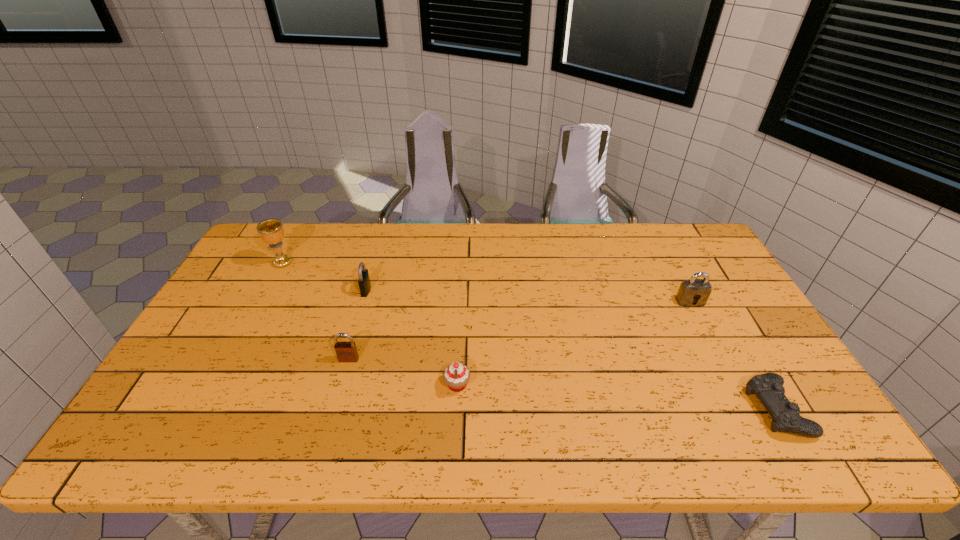
Identify the location of free space located 0.110m on the back of the shortest object. This screenshot has height=540, width=960. tap(740, 346).

Locate an element on the screen. Image resolution: width=960 pixels, height=540 pixels. object present at the far edge is located at coordinates (271, 231).

Locate an element on the screen. The image size is (960, 540). object located in the near edge section of the desktop is located at coordinates (768, 387).

Where is `object that is positioned at the left edge`? The image size is (960, 540). object that is positioned at the left edge is located at coordinates (271, 231).

Where is `padlock that is positioned at the right edge`? padlock that is positioned at the right edge is located at coordinates (690, 290).

This screenshot has height=540, width=960. I want to click on control at the right edge, so click(x=768, y=387).

The height and width of the screenshot is (540, 960). Find the location of `object positioned at the far left corner`. object positioned at the far left corner is located at coordinates (271, 231).

What are the coordinates of `object that is at the near right corner` in the screenshot? It's located at (768, 387).

The image size is (960, 540). What are the coordinates of `vacant space at the far edge of the desktop` in the screenshot? It's located at (490, 237).

In the image, there is a desktop. Where is `free space at the near edge`? The image size is (960, 540). free space at the near edge is located at coordinates (365, 435).